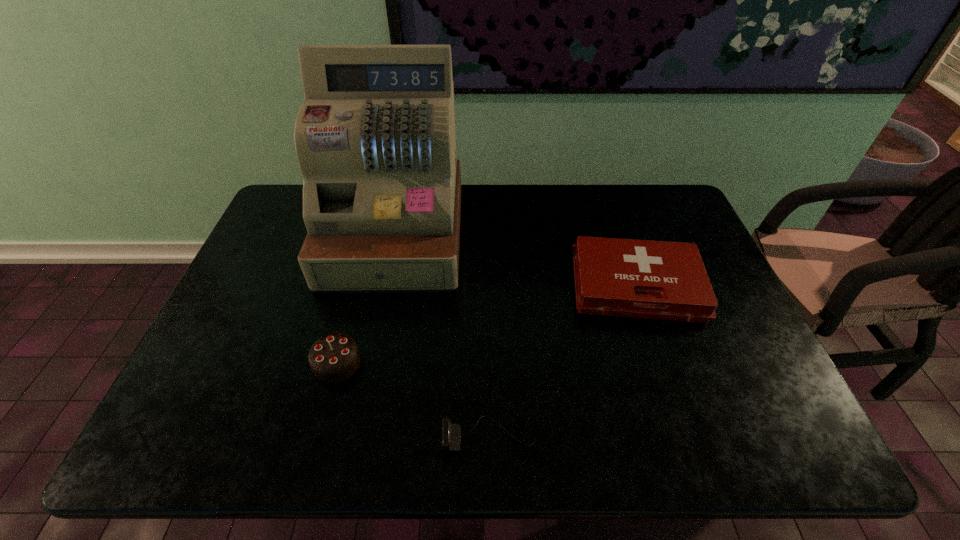
This screenshot has height=540, width=960. In order to click on vacant area situated 0.220m on the front-facing side of the shortest object in this screenshot , I will do `click(340, 436)`.

The image size is (960, 540). Find the location of `free region located 0.300m on the front-facing side of the shortest object`. free region located 0.300m on the front-facing side of the shortest object is located at coordinates (302, 436).

Locate an element on the screen. The width and height of the screenshot is (960, 540). free space located on the front-facing side of the shortest object is located at coordinates (311, 436).

Find the location of a particular element. This screenshot has width=960, height=540. object that is at the far edge is located at coordinates (375, 139).

Find the location of a particular element. object that is at the near edge is located at coordinates (451, 433).

At what (x,y) coordinates should I click in order to perform the action: click on object present at the right edge. Please return your answer as a coordinate pair (x, y). The width and height of the screenshot is (960, 540). Looking at the image, I should click on (662, 280).

Identify the location of vacant space at the far edge of the desktop. This screenshot has height=540, width=960. (588, 210).

Identify the location of free region at the near edge of the desktop. (629, 454).

Identify the location of vacant space at the left edge of the desktop. This screenshot has width=960, height=540. (253, 282).

The image size is (960, 540). In the image, there is a desktop. What are the coordinates of `vacant space at the right edge` in the screenshot? It's located at coord(730,315).